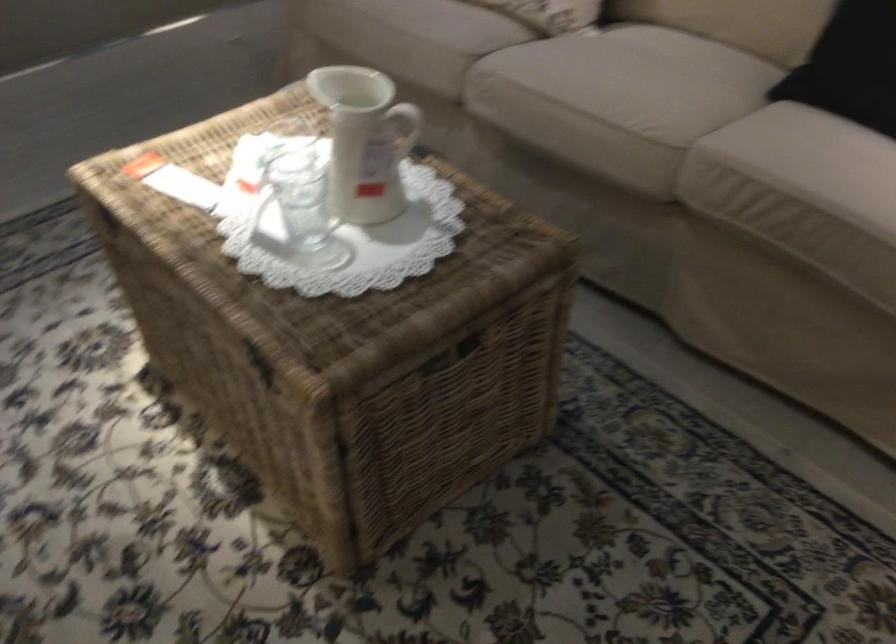
The image size is (896, 644). What do you see at coordinates (617, 93) in the screenshot?
I see `a sofa sitting surface` at bounding box center [617, 93].